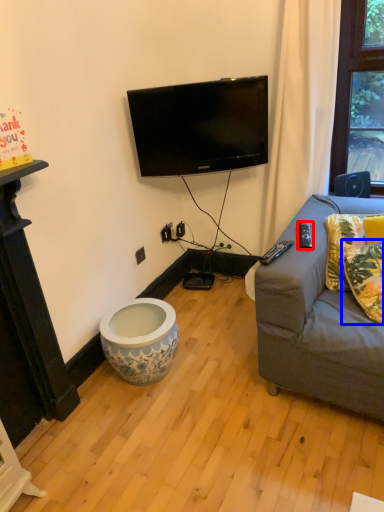
Question: Which object is further to the camera taking this photo, remote control (highlighted by a red box) or pillow (highlighted by a blue box)?

Choices:
 (A) remote control
 (B) pillow

Answer: (A)